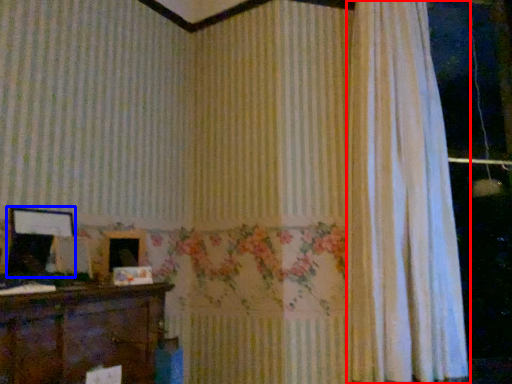
Question: Which of the following is the farthest to the observer, curtain (highlighted by a red box) or picture frame (highlighted by a blue box)?

Choices:
 (A) curtain
 (B) picture frame

Answer: (A)